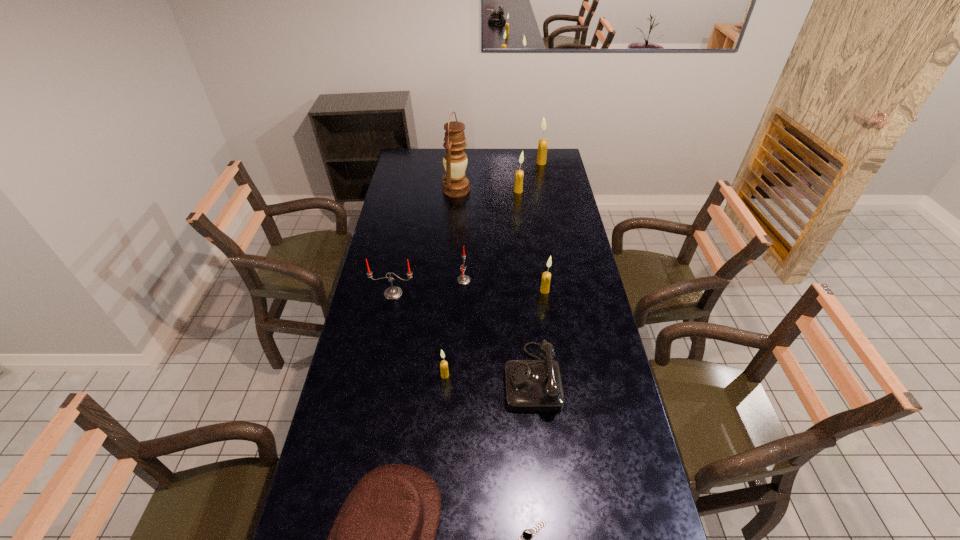
The height and width of the screenshot is (540, 960). Identify the location of free space at the right edge of the desktop. (555, 205).

Where is `vacant space at the far left corner of the desktop`? This screenshot has width=960, height=540. vacant space at the far left corner of the desktop is located at coordinates (402, 150).

Where is `empty space between the second farthest candle and the telephone`? This screenshot has height=540, width=960. empty space between the second farthest candle and the telephone is located at coordinates (525, 284).

The height and width of the screenshot is (540, 960). Find the location of `blank region between the right red candle and the leftmost candle`. blank region between the right red candle and the leftmost candle is located at coordinates (428, 287).

Where is `free point between the telephone and the rightmost object`? Image resolution: width=960 pixels, height=540 pixels. free point between the telephone and the rightmost object is located at coordinates (537, 270).

This screenshot has width=960, height=540. Identify the location of free space between the tallest object and the third biggest cream candle. (500, 240).

Locate an element on the screen. The width and height of the screenshot is (960, 540). free point between the left red candle and the fifth candle from left to right is located at coordinates (468, 292).

This screenshot has height=540, width=960. In order to click on free space that is in between the second candle from right to left and the oil lamp in this screenshot , I will do `click(500, 240)`.

Find the location of a particular element. This screenshot has height=540, width=960. vacant area that lies between the second farthest candle and the left red candle is located at coordinates (456, 242).

Locate which object is the closest to the third tallest object. Please provide its 2D coordinates. Your answer should be formatted as a tuple, i.e. [(x, y)], where the tuple contains the x and y coordinates of a point satisfying the conditions above.

[(455, 184)]